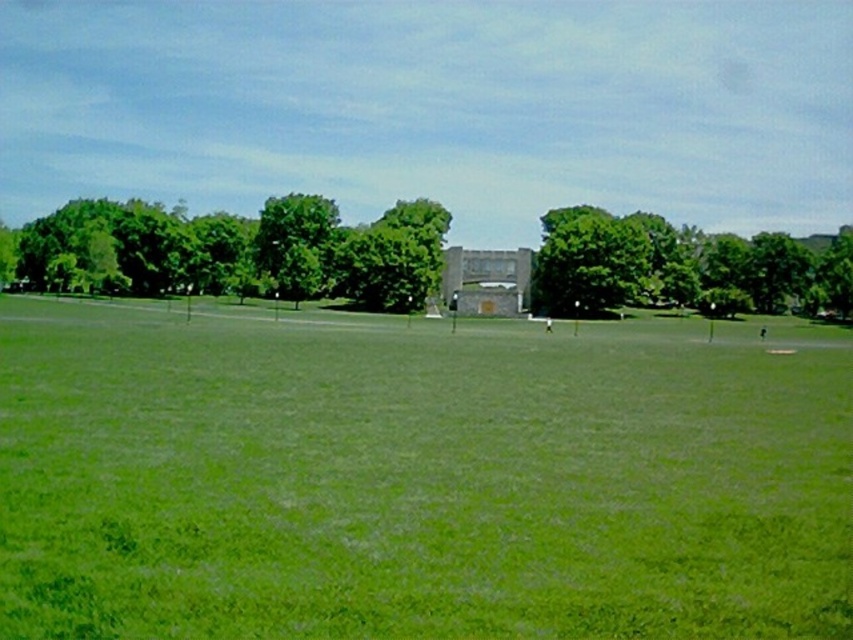
Is green grassy field at center smaller than green leafy tree at upper center?

Correct, green grassy field at center occupies less space than green leafy tree at upper center.

Is green grassy field at center closer to the viewer compared to green leafy tree at upper center?

That is True.

Locate an element on the screen. green grassy field at center is located at coordinates (416, 477).

Who is positioned more to the right, green grassy field at center or green leafy tree at center?

green leafy tree at center

Is point (347, 524) positioned in front of point (601, 288)?

Yes, point (347, 524) is in front of point (601, 288).

Is point (432, 445) closer to viewer compared to point (743, 280)?

Yes.

You are a GUI agent. You are given a task and a screenshot of the screen. Output one action in this format:
    pyautogui.click(x=<x>, y=<y>)
    Task: Click on the green grassy field at center
    
    Given the screenshot: What is the action you would take?
    pyautogui.click(x=416, y=477)

Can you confirm if green leafy tree at upper center is bigger than green leafy tree at center?

No.

Between point (346, 232) and point (770, 272), which one is positioned in front?

Point (770, 272) is more forward.

Image resolution: width=853 pixels, height=640 pixels. What are the coordinates of `green leafy tree at upper center` in the screenshot? It's located at (236, 252).

Find the location of `green leafy tree at upper center`. green leafy tree at upper center is located at coordinates [x=236, y=252].